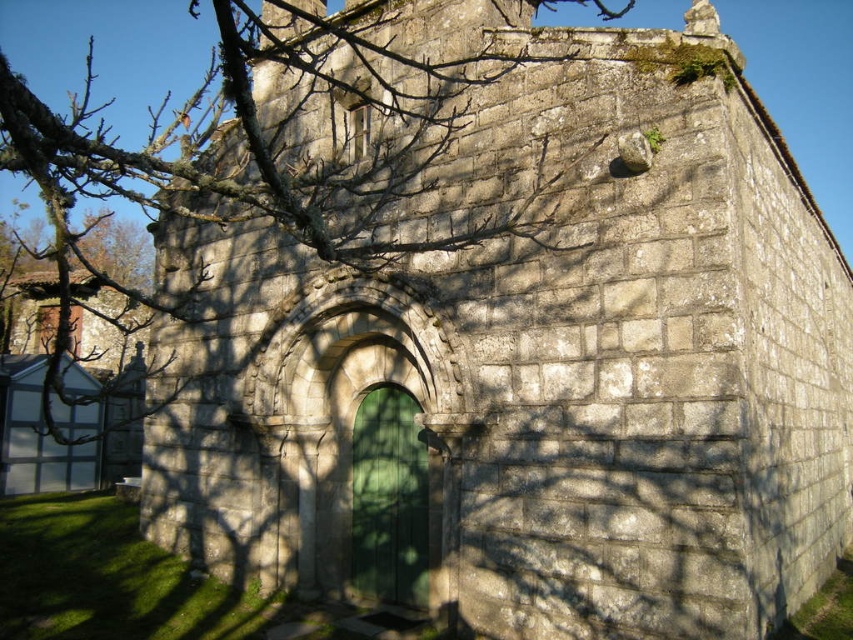
Between bare branches at upper left and green wooden door at center, which one appears on the right side from the viewer's perspective?

Positioned to the right is green wooden door at center.

Does bare branches at upper left have a smaller size compared to green wooden door at center?

Actually, bare branches at upper left might be larger than green wooden door at center.

Does point (372, 154) come farther from viewer compared to point (374, 598)?

Yes, it is behind point (374, 598).

Where is `bare branches at upper left`? This screenshot has width=853, height=640. bare branches at upper left is located at coordinates (299, 152).